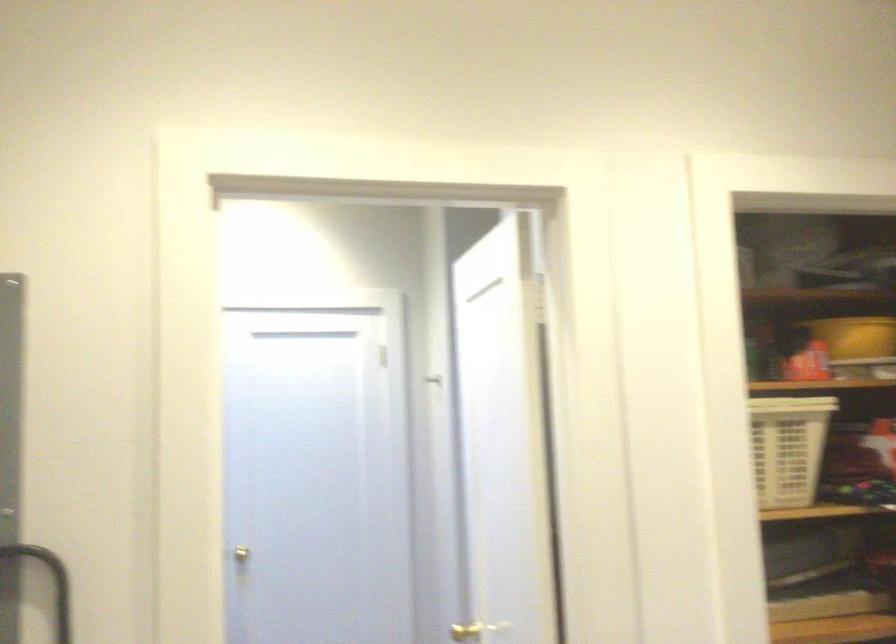
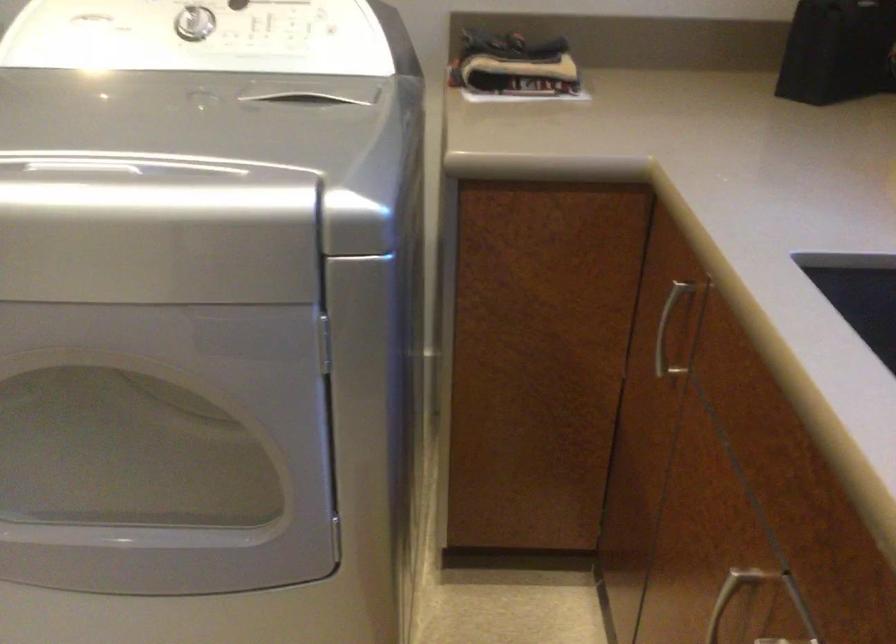
The images are taken continuously from a first-person perspective. In which direction is your viewpoint rotating?

The rotation direction of the camera is right-down.